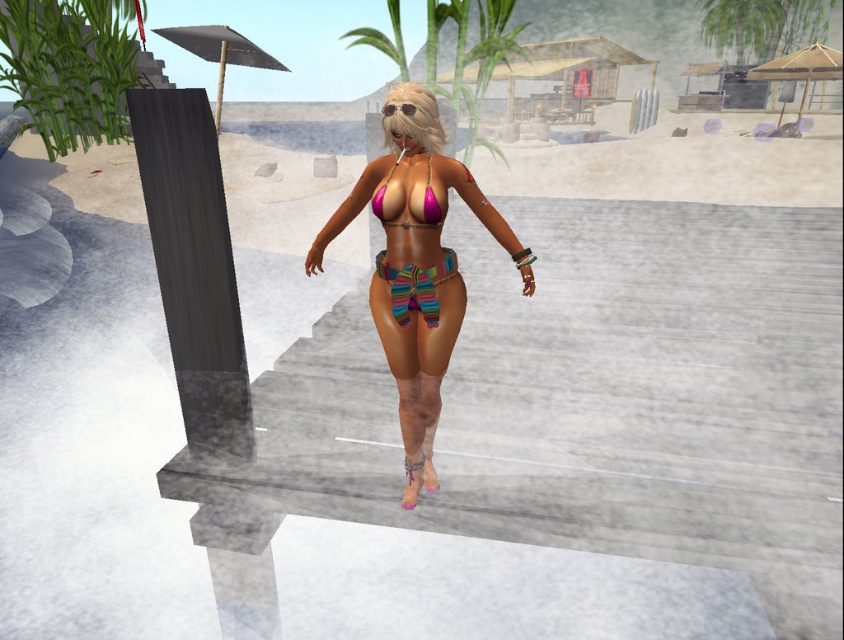
From the picture: Who is shorter, multicolored fabric bikini at center or gray matte umbrella at upper left?

multicolored fabric bikini at center

Which is behind, point (499, 230) or point (242, 65)?

The point (242, 65) is more distant.

Where is `multicolored fabric bikini at center`? The height and width of the screenshot is (640, 844). multicolored fabric bikini at center is located at coordinates (415, 262).

Who is more forward, (230,276) or (425,208)?

Positioned in front is point (425,208).

Is dark gray textured pillar at left closer to camera compared to pink matte bikini top at center?

Yes, dark gray textured pillar at left is in front of pink matte bikini top at center.

Does point (220, 348) lie in front of point (382, 212)?

No, (220, 348) is behind (382, 212).

Identify the location of dark gray textured pillar at left. (193, 266).

Is multicolored fabric bikini at center thinner than beige fabric umbrella at upper center?

In fact, multicolored fabric bikini at center might be wider than beige fabric umbrella at upper center.

Does multicolored fabric bikini at center come behind beige fabric umbrella at upper center?

No, multicolored fabric bikini at center is closer to the viewer.

You are a GUI agent. You are given a task and a screenshot of the screen. Output one action in this format:
    pyautogui.click(x=<x>, y=<y>)
    Task: Click on the multicolored fabric bikini at center
    This screenshot has height=640, width=844.
    Given the screenshot: What is the action you would take?
    pyautogui.click(x=415, y=262)